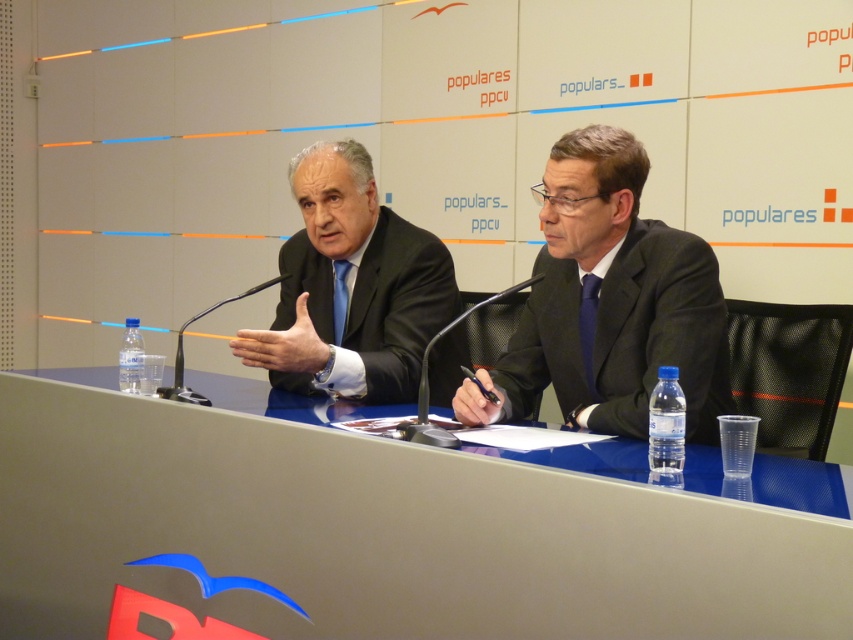
Is dark gray suit at center to the right of black matte suit at center from the viewer's perspective?

Yes, dark gray suit at center is to the right of black matte suit at center.

Can you confirm if dark gray suit at center is bigger than black matte suit at center?

Yes, dark gray suit at center is bigger than black matte suit at center.

In order to click on dark gray suit at center in this screenshot , I will do `click(624, 336)`.

Between blue glossy table at center and dark gray suit at center, which one has less height?

Standing shorter between the two is dark gray suit at center.

Measure the distance between blue glossy table at center and camera.

blue glossy table at center is 1.06 meters from camera.

Is point (697, 593) farther from camera compared to point (679, 310)?

No, it is in front of (679, 310).

Identify the location of blue glossy table at center. The width and height of the screenshot is (853, 640). (389, 525).

Does blue glossy table at center have a lesser height compared to black matte suit at center?

Incorrect, blue glossy table at center's height does not fall short of black matte suit at center's.

Does blue glossy table at center have a lesser width compared to black matte suit at center?

No.

Which is behind, point (155, 566) or point (445, 294)?

Positioned behind is point (445, 294).

The image size is (853, 640). I want to click on blue glossy table at center, so click(x=389, y=525).